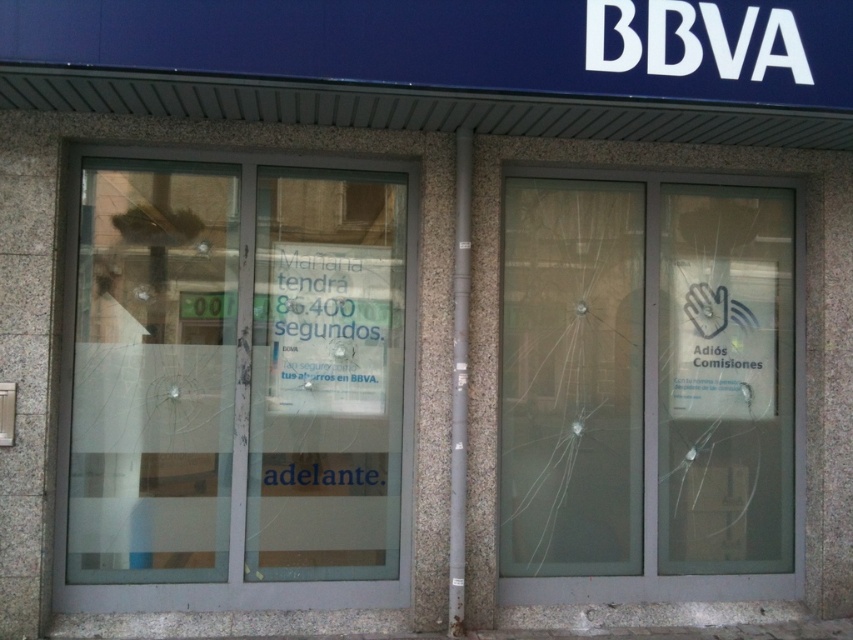
Question: Does transparent glass door at center have a greater width compared to transparent glass door at right?

Choices:
 (A) no
 (B) yes

Answer: (B)

Question: Considering the relative positions of transparent glass door at center and transparent glass door at right in the image provided, where is transparent glass door at center located with respect to transparent glass door at right?

Choices:
 (A) above
 (B) below

Answer: (A)

Question: Which point is farther to the camera?

Choices:
 (A) (697, 422)
 (B) (96, 323)

Answer: (A)

Question: Can you confirm if transparent glass door at center is positioned below transparent glass door at right?

Choices:
 (A) yes
 (B) no

Answer: (B)